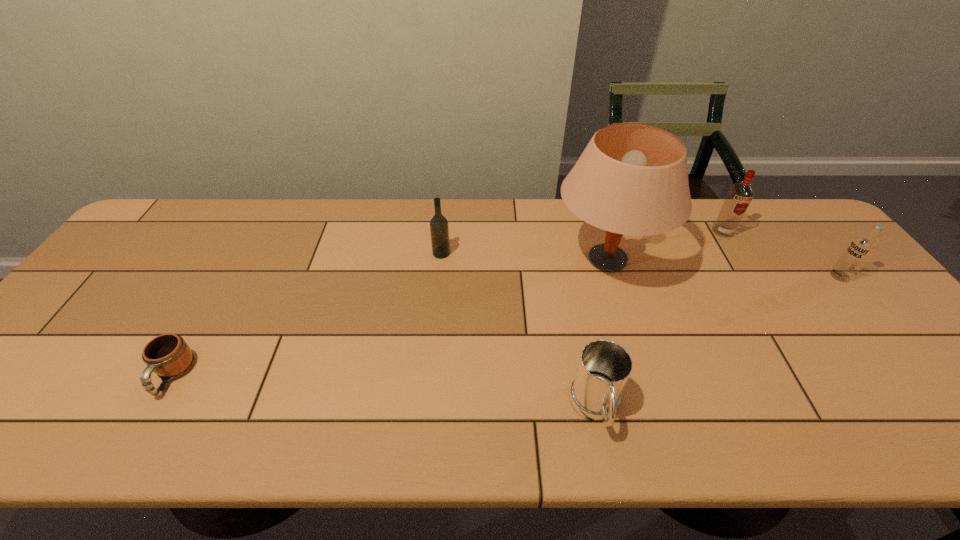
Identify the location of the left mug. The height and width of the screenshot is (540, 960). (168, 355).

The height and width of the screenshot is (540, 960). In order to click on vacant position located on the front-facing side of the tallest object in this screenshot , I will do `click(627, 326)`.

Where is `vacant area located 0.380m on the front label of the fifth object from left to right`? vacant area located 0.380m on the front label of the fifth object from left to right is located at coordinates (789, 339).

Locate an element on the screen. The height and width of the screenshot is (540, 960). vacant space located on the front of the second farthest vodka is located at coordinates (432, 353).

Identify the location of free location located 0.240m on the front label of the rightmost vodka. (744, 276).

The image size is (960, 540). Identify the location of blank space located 0.260m on the front label of the rightmost vodka. (737, 276).

At what (x,y) coordinates should I click in order to perform the action: click on free space located 0.210m on the front label of the rightmost vodka. Please return your answer as a coordinate pair (x, y). Looking at the image, I should click on (755, 276).

Find the location of a particular element. Image resolution: width=960 pixels, height=540 pixels. free space located 0.090m on the side of the leftmost object with the handle is located at coordinates (135, 442).

Identify the location of lampshade at the far edge. (632, 179).

Locate an element on the screen. vodka present at the far edge is located at coordinates (740, 195).